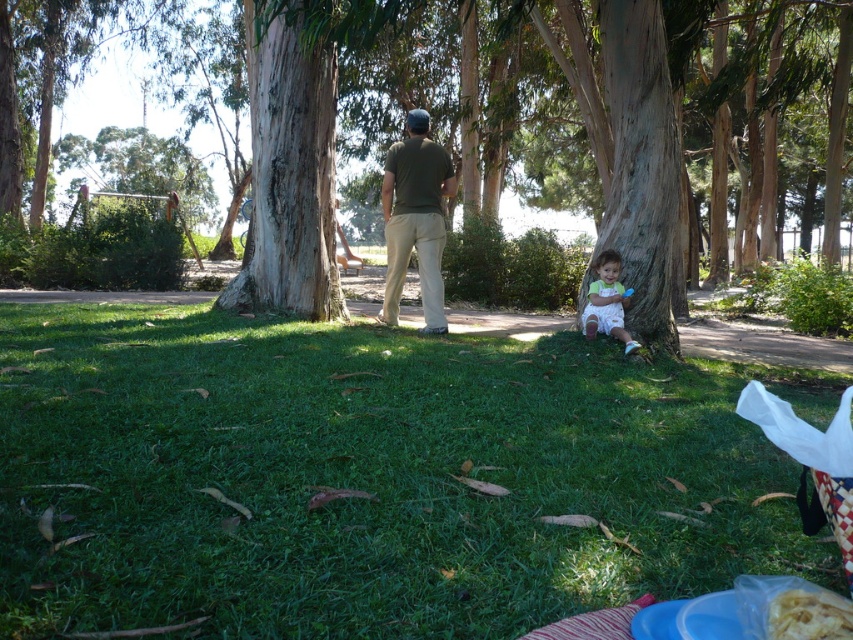
Question: Can you confirm if green grass at lower center is positioned to the right of white crinkled paper at lower right?

Choices:
 (A) no
 (B) yes

Answer: (A)

Question: Among these objects, which one is farthest from the camera?

Choices:
 (A) light green fabric baby at lower right
 (B) brown textured tree at center

Answer: (A)

Question: Which object is closer to the camera taking this photo?

Choices:
 (A) green matte shirt at center
 (B) light green fabric baby at lower right
 (C) green grass at lower center
 (D) white crinkled paper at lower right

Answer: (D)

Question: Which is nearer to the green grass at lower center?

Choices:
 (A) light green fabric baby at lower right
 (B) white crinkled paper at lower right

Answer: (B)

Question: Is green grass at lower center above brown textured tree at center?

Choices:
 (A) no
 (B) yes

Answer: (A)

Question: Is green grass at lower center bigger than white crinkled paper at lower right?

Choices:
 (A) no
 (B) yes

Answer: (B)